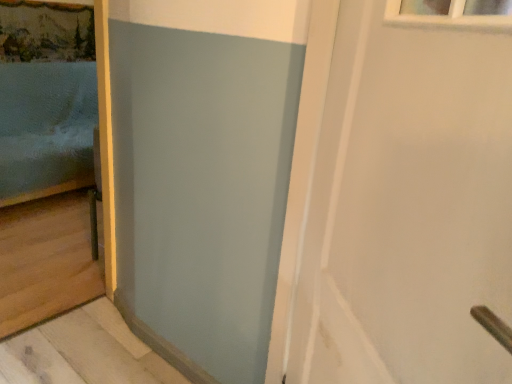
What do you see at coordinates (407, 206) in the screenshot?
I see `white matte door at upper right` at bounding box center [407, 206].

This screenshot has width=512, height=384. Identify the location of white matte door at upper right. (407, 206).

Image resolution: width=512 pixels, height=384 pixels. Describe the element at coordinates (46, 129) in the screenshot. I see `matte blue bed at left` at that location.

The image size is (512, 384). In order to click on matte blue bed at left in this screenshot , I will do `click(46, 129)`.

Find the location of `white matte door at upper right`. white matte door at upper right is located at coordinates (407, 206).

Is white matte door at upper right to the right of matte blue bed at left from the viewer's perspective?

Correct, you'll find white matte door at upper right to the right of matte blue bed at left.

Which object is closer to the camera, white matte door at upper right or matte blue bed at left?

white matte door at upper right is closer to the camera.

Is point (413, 122) closer or farther from the camera than point (27, 92)?

Clearly, point (413, 122) is closer to the camera than point (27, 92).

From the image's perspective, is white matte door at upper right below matte blue bed at left?

Yes, from the image's perspective, white matte door at upper right is beneath matte blue bed at left.

Looking at this image, from a real-world perspective, who is located higher, white matte door at upper right or matte blue bed at left?

In real-world perspective, white matte door at upper right is above.

Which object is thinner, white matte door at upper right or matte blue bed at left?

With smaller width is white matte door at upper right.

Considering the sizes of white matte door at upper right and matte blue bed at left in the image, is white matte door at upper right taller or shorter than matte blue bed at left?

In the image, white matte door at upper right appears to be shorter than matte blue bed at left.

Between white matte door at upper right and matte blue bed at left, which one has larger size?

matte blue bed at left.

Is white matte door at upper right spatially inside matte blue bed at left, or outside of it?

white matte door at upper right cannot be found inside matte blue bed at left.

Is white matte door at upper right placed right next to matte blue bed at left?

No, white matte door at upper right is not making contact with matte blue bed at left.

Does white matte door at upper right turn towards matte blue bed at left?

No, white matte door at upper right is not aimed at matte blue bed at left.

Can you tell me how much white matte door at upper right and matte blue bed at left differ in facing direction?

white matte door at upper right and matte blue bed at left are facing 51 degrees away from each other.

Where is `door positioned vertically above the matte blue bed at left (from a real-world perspective)`? The image size is (512, 384). door positioned vertically above the matte blue bed at left (from a real-world perspective) is located at coordinates (407, 206).

Considering the relative positions of matte blue bed at left and white matte door at upper right in the image provided, is matte blue bed at left to the left of white matte door at upper right from the viewer's perspective?

Correct, you'll find matte blue bed at left to the left of white matte door at upper right.

Is matte blue bed at left in front of or behind white matte door at upper right in the image?

Clearly, matte blue bed at left is behind white matte door at upper right.

Between point (84, 82) and point (411, 53), which one is positioned behind?

The point (84, 82) is behind.

From the image's perspective, is matte blue bed at left on white matte door at upper right?

Yes, from the image's perspective, matte blue bed at left is on top of white matte door at upper right.

In the scene shown: From a real-world perspective, between matte blue bed at left and white matte door at upper right, who is vertically higher?

white matte door at upper right is physically above.

Considering the sizes of objects matte blue bed at left and white matte door at upper right in the image provided, who is wider, matte blue bed at left or white matte door at upper right?

With larger width is matte blue bed at left.

Based on the photo, which of these two, matte blue bed at left or white matte door at upper right, stands shorter?

white matte door at upper right.

Can you confirm if matte blue bed at left is bigger than white matte door at upper right?

Correct, matte blue bed at left is larger in size than white matte door at upper right.

Consider the image. Would you say matte blue bed at left is inside or outside white matte door at upper right?

matte blue bed at left lies outside white matte door at upper right.

Is matte blue bed at left directly adjacent to white matte door at upper right?

No.

Is matte blue bed at left facing away from white matte door at upper right?

No, matte blue bed at left's orientation is not away from white matte door at upper right.

What's the angular difference between matte blue bed at left and white matte door at upper right's facing directions?

The angle between the facing direction of matte blue bed at left and the facing direction of white matte door at upper right is 51 degrees.

Find the location of a particular element. Image resolution: width=512 pixels, height=384 pixels. door below the matte blue bed at left (from the image's perspective) is located at coordinates (407, 206).

Locate an element on the screen. bed above the white matte door at upper right (from the image's perspective) is located at coordinates (46, 129).

Where is `bed on the left of the white matte door at upper right`? bed on the left of the white matte door at upper right is located at coordinates (46, 129).